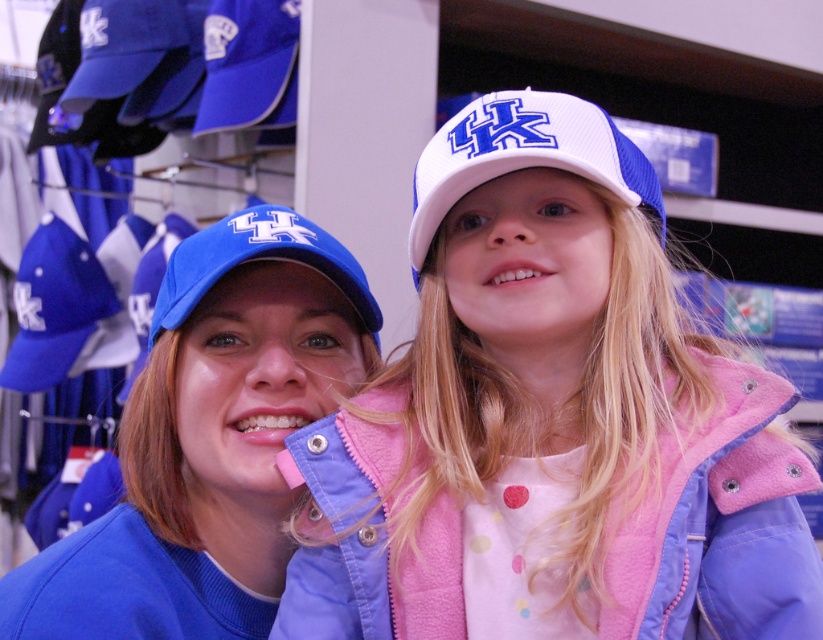
Question: Is matte blue cap at center above matte blue baseball cap at center?

Choices:
 (A) yes
 (B) no

Answer: (B)

Question: Does matte blue cap at center have a lesser width compared to matte blue baseball cap at center?

Choices:
 (A) no
 (B) yes

Answer: (A)

Question: Which of these objects is positioned closest to the white mesh baseball cap at upper center?

Choices:
 (A) matte blue cap at center
 (B) blue fabric baseball cap at center

Answer: (B)

Question: Based on their relative distances, which object is farther from the white mesh baseball cap at upper center?

Choices:
 (A) matte blue cap at center
 (B) white mesh cap at center
 (C) matte blue baseball cap at center
 (D) blue fabric baseball cap at center

Answer: (C)

Question: Which point is closer to the camera taking this photo?

Choices:
 (A) (328, 339)
 (B) (33, 332)

Answer: (A)

Question: Can you confirm if white mesh cap at center is positioned to the right of matte blue baseball cap at center?

Choices:
 (A) yes
 (B) no

Answer: (A)